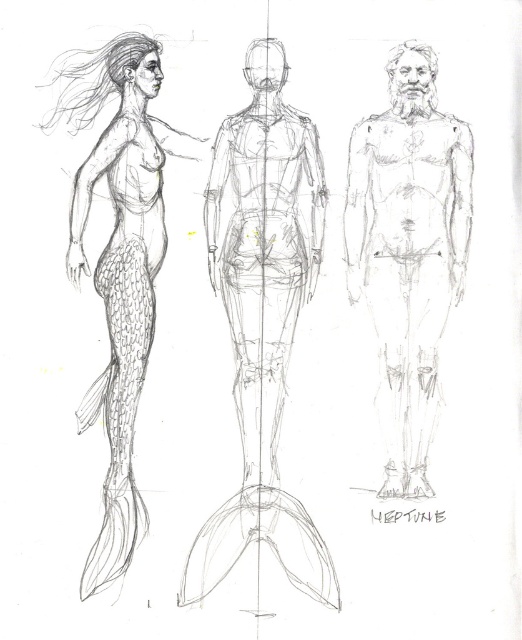
Find the location of a particular element. smooth skin figure at center is located at coordinates (409, 252).

Does smooth skin figure at center have a smaller size compared to smooth gray tail at left?

Correct, smooth skin figure at center occupies less space than smooth gray tail at left.

Is point (455, 225) more distant than point (99, 60)?

That is True.

Find the location of a particular element. This screenshot has width=522, height=640. smooth skin figure at center is located at coordinates (409, 252).

Can you confirm if smooth pencil sketch of humanoid figure at center is bigger than smooth skin figure at center?

Yes, smooth pencil sketch of humanoid figure at center is bigger than smooth skin figure at center.

Who is positioned more to the right, smooth pencil sketch of humanoid figure at center or smooth skin figure at center?

smooth skin figure at center is more to the right.

Who is more forward, (235,230) or (404,461)?

Point (404,461) is more forward.

Locate an element on the screen. smooth pencil sketch of humanoid figure at center is located at coordinates (262, 310).

Measure the distance between point (310, 291) and camera.

They are 6.23 feet apart.

In the scene shown: Does smooth pencil sketch of humanoid figure at center have a larger size compared to smooth gray tail at left?

Incorrect, smooth pencil sketch of humanoid figure at center is not larger than smooth gray tail at left.

Is point (256, 442) in front of point (124, 458)?

No, (256, 442) is further to viewer.

Identify the location of smooth pencil sketch of humanoid figure at center. This screenshot has height=640, width=522. (262, 310).